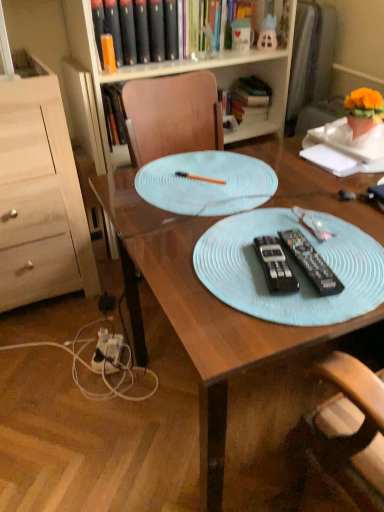
You are a GUI agent. You are given a task and a screenshot of the screen. Output one action in this format:
    pyautogui.click(x=<x>, y=<y>)
    Task: Click on the free region on the left part of black plastic remote control at center, marked as the second remote control in a right-to-left arrangement
    
    Given the screenshot: What is the action you would take?
    pyautogui.click(x=201, y=267)